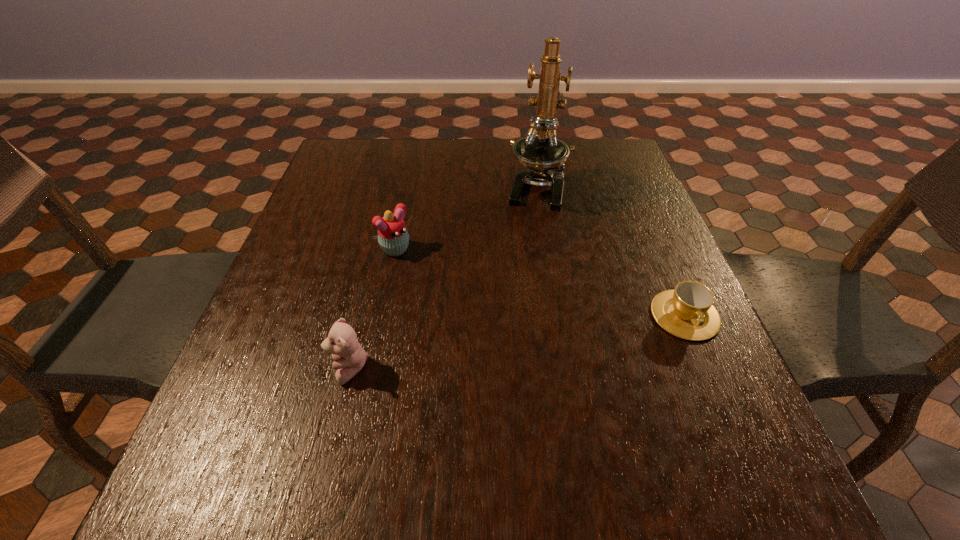
This screenshot has height=540, width=960. I want to click on vacant area that lies between the farthest object and the third nearest object, so click(x=468, y=220).

I want to click on unoccupied area between the microscope and the third nearest object, so click(468, 220).

Where is `empty space between the third object from left to right and the teddy bear`? This screenshot has height=540, width=960. empty space between the third object from left to right and the teddy bear is located at coordinates (443, 279).

You are a GUI agent. You are given a task and a screenshot of the screen. Output one action in this format:
    pyautogui.click(x=<x>, y=<y>)
    Task: Click on the empty space between the second nearest object and the nearest object
    
    Given the screenshot: What is the action you would take?
    pos(517,342)

Find the location of `object that is the third closest to the teddy bear`. object that is the third closest to the teddy bear is located at coordinates (687, 311).

Identify which object is the closest to the microscope. Please provide its 2D coordinates. Your answer should be formatted as a tuple, i.e. [(x, y)], where the tuple contains the x and y coordinates of a point satisfying the conditions above.

[(393, 238)]

Find the location of `blank area in the image that satisfies the following two spatial constraints: 1. on the back side of the farthest object; 2. on the left side of the third nearest object`. blank area in the image that satisfies the following two spatial constraints: 1. on the back side of the farthest object; 2. on the left side of the third nearest object is located at coordinates (411, 188).